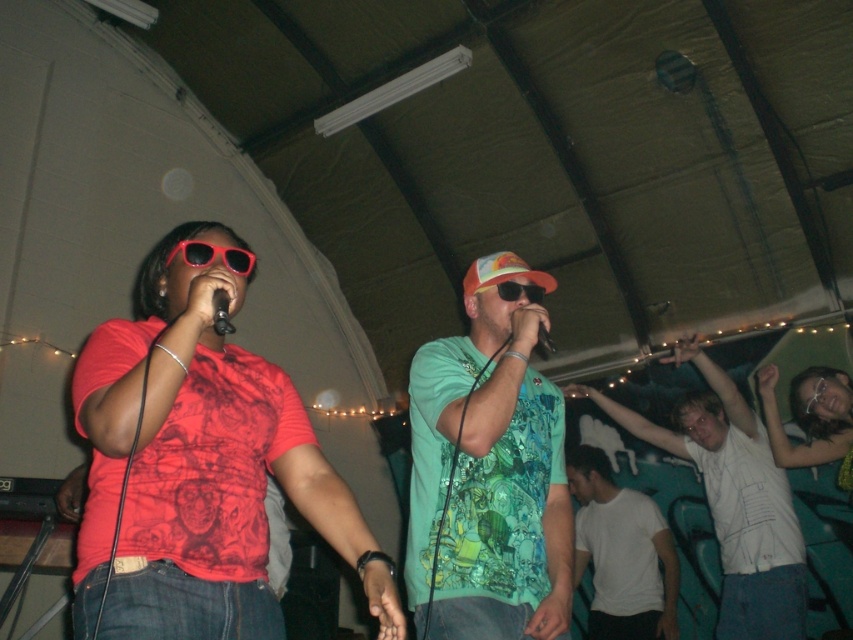
Question: Which of the following is the farthest from the observer?

Choices:
 (A) (151, 484)
 (B) (750, 611)
 (C) (496, 444)

Answer: (B)

Question: Which point is farther to the camera?

Choices:
 (A) translucent plastic sunglasses at center
 (B) black matte microphone at center
 (C) matte red sunglasses at upper left

Answer: (A)

Question: Which object is the closest to the white matte t-shirt at lower right?

Choices:
 (A) white cotton shirt at lower right
 (B) black matte microphone at center

Answer: (A)

Question: Is the position of green printed t-shirt at center less distant than that of black matte microphone at center?

Choices:
 (A) no
 (B) yes

Answer: (A)

Question: Can you confirm if matte red sunglasses at upper left is smaller than translucent plastic sunglasses at center?

Choices:
 (A) yes
 (B) no

Answer: (B)

Question: From the image, what is the correct spatial relationship of white cotton shirt at lower right in relation to shiny plastic sunglasses at upper left?

Choices:
 (A) above
 (B) below

Answer: (B)